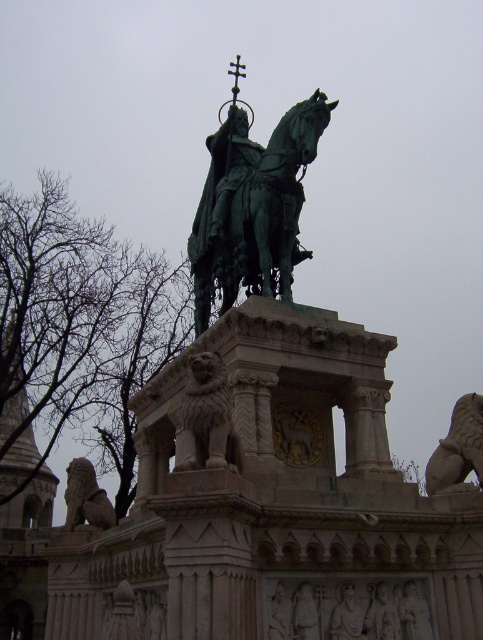
Is gray stone lion at center wider than stone lion at lower right?

No.

Who is positioned more to the left, gray stone lion at center or stone lion at lower right?

gray stone lion at center is more to the left.

Does point (185, 440) lie behind point (472, 401)?

No, (185, 440) is in front of (472, 401).

Find the location of `gray stone lion at center`. gray stone lion at center is located at coordinates (208, 419).

This screenshot has width=483, height=640. What do you see at coordinates (254, 211) in the screenshot?
I see `green polished metal horse at center` at bounding box center [254, 211].

Does green polished metal horse at center appear on the right side of gray stone lion at lower left?

Yes, green polished metal horse at center is to the right of gray stone lion at lower left.

Locate an element on the screen. This screenshot has height=640, width=483. green polished metal horse at center is located at coordinates 254,211.

Where is `green polished metal horse at center`? The image size is (483, 640). green polished metal horse at center is located at coordinates (254, 211).

Which is behind, point (186, 424) or point (85, 508)?

Point (85, 508)

Who is higher up, gray stone lion at center or gray stone lion at lower left?

gray stone lion at center

Who is more distant from viewer, [185,436] or [107,508]?

The point [107,508] is more distant.

Where is `gray stone lion at center`? The image size is (483, 640). gray stone lion at center is located at coordinates (208, 419).